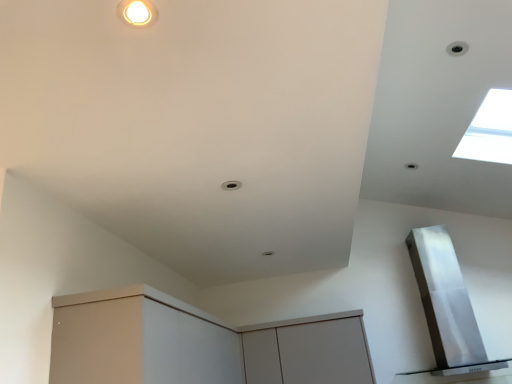
At what (x,y) coordinates should I click in order to perform the action: click on transparent glass window at upper right. Please return your answer as a coordinate pair (x, y). This screenshot has height=384, width=512. Looking at the image, I should click on (489, 130).

In order to face matte gray cabinet at center, positioned as the 1th cabinetry in right-to-left order, should I rotate leftwards or rightwards?

To face it directly, rotate right by 7.075 degrees.

What is the approximate width of satin silver exhaust hood at upper right?

satin silver exhaust hood at upper right is 49.11 centimeters wide.

Identify the location of matte white cabinet at lower left, marked as the second cabinetry in a right-to-left arrangement. (197, 344).

How distant is satin silver exhaust hood at upper right from transparent glass window at upper right?

satin silver exhaust hood at upper right is 3.30 feet away from transparent glass window at upper right.

Can you tell me how much satin silver exhaust hood at upper right and transparent glass window at upper right differ in facing direction?

satin silver exhaust hood at upper right and transparent glass window at upper right are facing 88.4 degrees away from each other.

Can you confirm if satin silver exhaust hood at upper right is taller than transparent glass window at upper right?

Yes.

From a real-world perspective, is satin silver exhaust hood at upper right above or below transparent glass window at upper right?

satin silver exhaust hood at upper right is below transparent glass window at upper right.

Which of these two, transparent glass window at upper right or satin silver exhaust hood at upper right, is smaller?

transparent glass window at upper right.

Which is behind, point (483, 139) or point (448, 346)?

Point (448, 346)

Consider the image. Who is taller, transparent glass window at upper right or satin silver exhaust hood at upper right?

satin silver exhaust hood at upper right is taller.

Between transparent glass window at upper right and satin silver exhaust hood at upper right, which one appears on the right side from the viewer's perspective?

Positioned to the right is transparent glass window at upper right.

How many degrees apart are the facing directions of matte gray cabinet at center, which is the second cabinetry in left-to-right order, and transparent glass window at upper right?

The angle between the facing direction of matte gray cabinet at center, which is the second cabinetry in left-to-right order, and the facing direction of transparent glass window at upper right is 89.1 degrees.

Looking at this image, is matte gray cabinet at center, which is the second cabinetry in left-to-right order, surrounding transparent glass window at upper right?

No, transparent glass window at upper right is not surrounded by matte gray cabinet at center, which is the second cabinetry in left-to-right order.

From a real-world perspective, is matte gray cabinet at center, which is the second cabinetry in left-to-right order, physically below transparent glass window at upper right?

Yes, from a real-world perspective, matte gray cabinet at center, which is the second cabinetry in left-to-right order, is below transparent glass window at upper right.

Does matte gray cabinet at center, positioned as the 1th cabinetry in right-to-left order, have a larger size compared to transparent glass window at upper right?

Yes.

Is matte gray cabinet at center, positioned as the 1th cabinetry in right-to-left order, aimed at matte white cabinet at lower left, acting as the 1th cabinetry starting from the left?

Yes, matte gray cabinet at center, positioned as the 1th cabinetry in right-to-left order, faces towards matte white cabinet at lower left, acting as the 1th cabinetry starting from the left.

Which is closer, (251, 334) or (133, 330)?

Point (251, 334) appears to be farther away from the viewer than point (133, 330).

From a real-world perspective, is matte gray cabinet at center, which is the second cabinetry in left-to-right order, above or below matte white cabinet at lower left, acting as the 1th cabinetry starting from the left?

matte gray cabinet at center, which is the second cabinetry in left-to-right order, is situated lower than matte white cabinet at lower left, acting as the 1th cabinetry starting from the left, in the real world.

Is satin silver exhaust hood at upper right taller or shorter than matte white cabinet at lower left, marked as the second cabinetry in a right-to-left arrangement?

Considering their sizes, satin silver exhaust hood at upper right has more height than matte white cabinet at lower left, marked as the second cabinetry in a right-to-left arrangement.

From a real-world perspective, is satin silver exhaust hood at upper right positioned above or below matte white cabinet at lower left, marked as the second cabinetry in a right-to-left arrangement?

satin silver exhaust hood at upper right is above matte white cabinet at lower left, marked as the second cabinetry in a right-to-left arrangement.

Based on the photo, is satin silver exhaust hood at upper right in contact with matte white cabinet at lower left, acting as the 1th cabinetry starting from the left?

They are not placed beside each other.

Which is more to the left, satin silver exhaust hood at upper right or matte white cabinet at lower left, marked as the second cabinetry in a right-to-left arrangement?

From the viewer's perspective, matte white cabinet at lower left, marked as the second cabinetry in a right-to-left arrangement, appears more on the left side.

From the picture: Is matte gray cabinet at center, which is the second cabinetry in left-to-right order, turned away from satin silver exhaust hood at upper right?

No, matte gray cabinet at center, which is the second cabinetry in left-to-right order,'s orientation is not away from satin silver exhaust hood at upper right.

Is point (250, 382) positioned after point (444, 293)?

No, it is in front of (444, 293).

From the image's perspective, which one is positioned lower, matte gray cabinet at center, positioned as the 1th cabinetry in right-to-left order, or satin silver exhaust hood at upper right?

matte gray cabinet at center, positioned as the 1th cabinetry in right-to-left order, from the image's perspective.

Considering the relative sizes of matte gray cabinet at center, positioned as the 1th cabinetry in right-to-left order, and satin silver exhaust hood at upper right in the image provided, is matte gray cabinet at center, positioned as the 1th cabinetry in right-to-left order, wider than satin silver exhaust hood at upper right?

In fact, matte gray cabinet at center, positioned as the 1th cabinetry in right-to-left order, might be narrower than satin silver exhaust hood at upper right.

Which is correct: matte white cabinet at lower left, marked as the second cabinetry in a right-to-left arrangement, is inside satin silver exhaust hood at upper right, or outside of it?

matte white cabinet at lower left, marked as the second cabinetry in a right-to-left arrangement, is located beyond the bounds of satin silver exhaust hood at upper right.

Can you tell me how much matte white cabinet at lower left, acting as the 1th cabinetry starting from the left, and satin silver exhaust hood at upper right differ in facing direction?

matte white cabinet at lower left, acting as the 1th cabinetry starting from the left, and satin silver exhaust hood at upper right are facing 0.493 degrees away from each other.

Considering the relative sizes of matte white cabinet at lower left, marked as the second cabinetry in a right-to-left arrangement, and satin silver exhaust hood at upper right in the image provided, is matte white cabinet at lower left, marked as the second cabinetry in a right-to-left arrangement, shorter than satin silver exhaust hood at upper right?

Yes.

Considering the positions of objects matte white cabinet at lower left, acting as the 1th cabinetry starting from the left, and satin silver exhaust hood at upper right in the image provided, who is more to the left, matte white cabinet at lower left, acting as the 1th cabinetry starting from the left, or satin silver exhaust hood at upper right?

Positioned to the left is matte white cabinet at lower left, acting as the 1th cabinetry starting from the left.

Find the location of `window above the satin silver exhaust hood at upper right (from the image's perspective)`. window above the satin silver exhaust hood at upper right (from the image's perspective) is located at coordinates (489, 130).

Locate an element on the screen. The width and height of the screenshot is (512, 384). window that appears in front of the satin silver exhaust hood at upper right is located at coordinates (489, 130).

Considering their positions, is satin silver exhaust hood at upper right positioned closer to matte white cabinet at lower left, acting as the 1th cabinetry starting from the left, than matte gray cabinet at center, which is the second cabinetry in left-to-right order?

Among the two, matte gray cabinet at center, which is the second cabinetry in left-to-right order, is located nearer to matte white cabinet at lower left, acting as the 1th cabinetry starting from the left.

Looking at the image, which one is located closer to matte gray cabinet at center, positioned as the 1th cabinetry in right-to-left order, matte white cabinet at lower left, marked as the second cabinetry in a right-to-left arrangement, or transparent glass window at upper right?

Based on the image, matte white cabinet at lower left, marked as the second cabinetry in a right-to-left arrangement, appears to be nearer to matte gray cabinet at center, positioned as the 1th cabinetry in right-to-left order.

When comparing their distances from matte gray cabinet at center, which is the second cabinetry in left-to-right order, does satin silver exhaust hood at upper right or transparent glass window at upper right seem closer?

satin silver exhaust hood at upper right is closer to matte gray cabinet at center, which is the second cabinetry in left-to-right order.

From the image, which object appears to be farther from matte white cabinet at lower left, marked as the second cabinetry in a right-to-left arrangement, matte gray cabinet at center, positioned as the 1th cabinetry in right-to-left order, or transparent glass window at upper right?

transparent glass window at upper right lies further to matte white cabinet at lower left, marked as the second cabinetry in a right-to-left arrangement, than the other object.

Which object lies further to the anchor point satin silver exhaust hood at upper right, transparent glass window at upper right or matte white cabinet at lower left, marked as the second cabinetry in a right-to-left arrangement?

matte white cabinet at lower left, marked as the second cabinetry in a right-to-left arrangement, is positioned further to the anchor satin silver exhaust hood at upper right.

When comparing their distances from transparent glass window at upper right, does matte gray cabinet at center, positioned as the 1th cabinetry in right-to-left order, or satin silver exhaust hood at upper right seem further?

The object further to transparent glass window at upper right is matte gray cabinet at center, positioned as the 1th cabinetry in right-to-left order.

From the image, which object appears to be farther from satin silver exhaust hood at upper right, matte white cabinet at lower left, marked as the second cabinetry in a right-to-left arrangement, or matte gray cabinet at center, positioned as the 1th cabinetry in right-to-left order?

The object further to satin silver exhaust hood at upper right is matte white cabinet at lower left, marked as the second cabinetry in a right-to-left arrangement.

From the image, which object appears to be farther from matte white cabinet at lower left, acting as the 1th cabinetry starting from the left, transparent glass window at upper right or matte gray cabinet at center, positioned as the 1th cabinetry in right-to-left order?

transparent glass window at upper right.

Image resolution: width=512 pixels, height=384 pixels. In order to click on cabinetry between matte white cabinet at lower left, marked as the second cabinetry in a right-to-left arrangement, and satin silver exhaust hood at upper right from left to right in this screenshot , I will do `click(309, 353)`.

Identify the location of cabinetry located between matte white cabinet at lower left, marked as the second cabinetry in a right-to-left arrangement, and transparent glass window at upper right in the left-right direction. Image resolution: width=512 pixels, height=384 pixels. (309, 353).

The image size is (512, 384). I want to click on exhaust hood between matte white cabinet at lower left, acting as the 1th cabinetry starting from the left, and transparent glass window at upper right, so click(x=447, y=304).

Image resolution: width=512 pixels, height=384 pixels. Identify the location of exhaust hood between transparent glass window at upper right and matte gray cabinet at center, positioned as the 1th cabinetry in right-to-left order, in the vertical direction. (447, 304).